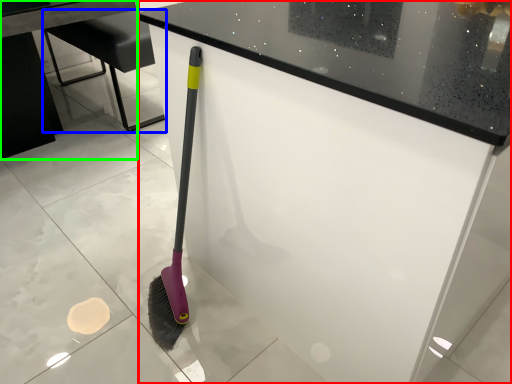
Question: Which object is the farthest from counter (highlighted by a red box)? Choose among these: furniture (highlighted by a blue box) or table (highlighted by a green box).

Choices:
 (A) furniture
 (B) table

Answer: (B)